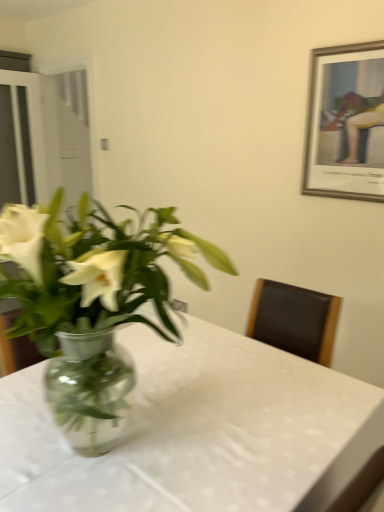
In order to face transparent glass door at left, which is the second glass door in left-to-right order, should I rotate leftwards or rightwards?

You should rotate left by 15.730 degrees.

Where is `transparent glass door at left, which is the first glass door from right to left`? This screenshot has height=512, width=384. transparent glass door at left, which is the first glass door from right to left is located at coordinates (67, 134).

Where is `clear glass vase at center`? This screenshot has height=512, width=384. clear glass vase at center is located at coordinates (92, 302).

You are a GUI agent. You are given a task and a screenshot of the screen. Output one action in this format:
    pyautogui.click(x=<x>, y=<y>)
    Task: Click on the houseplant below the silver/golden frame at upper right (from the image's perspective)
    This screenshot has width=384, height=512.
    Given the screenshot: What is the action you would take?
    pyautogui.click(x=92, y=302)

Consider the image. Considering the sizes of objects clear glass vase at center and silver/golden frame at upper right in the image provided, who is taller, clear glass vase at center or silver/golden frame at upper right?

silver/golden frame at upper right.

Considering the sizes of objects clear glass vase at center and silver/golden frame at upper right in the image provided, who is bigger, clear glass vase at center or silver/golden frame at upper right?

With larger size is clear glass vase at center.

Which object is thinner, clear glass vase at center or silver/golden frame at upper right?

With smaller width is silver/golden frame at upper right.

From the picture: Is transparent glass table at center completely or partially inside transparent glass door at left, the second glass door viewed from the right?

No.

Considering the relative sizes of transparent glass door at left, the second glass door viewed from the right, and transparent glass table at center in the image provided, is transparent glass door at left, the second glass door viewed from the right, thinner than transparent glass table at center?

Correct, the width of transparent glass door at left, the second glass door viewed from the right, is less than that of transparent glass table at center.

Is transparent glass door at left, arranged as the first glass door when viewed from the left, facing away from transparent glass table at center?

No, transparent glass door at left, arranged as the first glass door when viewed from the left,'s orientation is not away from transparent glass table at center.

Consider the image. Between transparent glass table at center and transparent glass door at left, which is the second glass door in left-to-right order, which one appears on the left side from the viewer's perspective?

Positioned to the left is transparent glass door at left, which is the second glass door in left-to-right order.

From the image's perspective, is transparent glass table at center on top of transparent glass door at left, which is the first glass door from right to left?

No, from the image's perspective, transparent glass table at center is not on top of transparent glass door at left, which is the first glass door from right to left.

Which is correct: transparent glass table at center is inside transparent glass door at left, which is the second glass door in left-to-right order, or outside of it?

transparent glass table at center cannot be found inside transparent glass door at left, which is the second glass door in left-to-right order.

From a real-world perspective, is transparent glass table at center positioned above or below transparent glass door at left, which is the second glass door in left-to-right order?

Clearly, from a real-world perspective, transparent glass table at center is below transparent glass door at left, which is the second glass door in left-to-right order.

Does clear glass vase at center have a greater width compared to transparent glass table at center?

Incorrect, the width of clear glass vase at center does not surpass that of transparent glass table at center.

From a real-world perspective, is clear glass vase at center located higher than transparent glass table at center?

Indeed, from a real-world perspective, clear glass vase at center stands above transparent glass table at center.

Between clear glass vase at center and transparent glass table at center, which one has larger size?

transparent glass table at center.

Which is less distant, (28, 144) or (315, 49)?

Point (28, 144).

What's the angular difference between transparent glass door at left, arranged as the first glass door when viewed from the left, and silver/golden frame at upper right's facing directions?

There is a 87.4-degree angle between the facing directions of transparent glass door at left, arranged as the first glass door when viewed from the left, and silver/golden frame at upper right.

Between transparent glass door at left, arranged as the first glass door when viewed from the left, and silver/golden frame at upper right, which one appears on the right side from the viewer's perspective?

From the viewer's perspective, silver/golden frame at upper right appears more on the right side.

From a real-world perspective, is silver/golden frame at upper right under transparent glass table at center?

No, from a real-world perspective, silver/golden frame at upper right is not below transparent glass table at center.

Are silver/golden frame at upper right and transparent glass table at center beside each other?

They are not placed beside each other.

From the image's perspective, would you say silver/golden frame at upper right is shown under transparent glass table at center?

Incorrect, from the image's perspective, silver/golden frame at upper right is higher than transparent glass table at center.

In the image, is silver/golden frame at upper right on the left side or the right side of transparent glass table at center?

In the image, silver/golden frame at upper right appears on the right side of transparent glass table at center.

Which is more to the right, transparent glass door at left, which is the first glass door from right to left, or transparent glass door at left, arranged as the first glass door when viewed from the left?

transparent glass door at left, which is the first glass door from right to left, is more to the right.

Based on the photo, does transparent glass door at left, which is the first glass door from right to left, turn towards transparent glass door at left, the second glass door viewed from the right?

Yes, transparent glass door at left, which is the first glass door from right to left, is oriented towards transparent glass door at left, the second glass door viewed from the right.

Identify the location of glass door above the transparent glass door at left, the second glass door viewed from the right (from the image's perspective). (67, 134).

Find the location of a particular element. The image size is (384, 512). picture frame above the clear glass vase at center (from a real-world perspective) is located at coordinates (346, 123).

Locate an element on the screen. The image size is (384, 512). table beneath the transparent glass door at left, arranged as the first glass door when viewed from the left (from a real-world perspective) is located at coordinates (198, 433).

Estimate the real-world distances between objects in this image. Which object is further from transparent glass door at left, the second glass door viewed from the right, clear glass vase at center or transparent glass table at center?

clear glass vase at center is positioned further to the anchor transparent glass door at left, the second glass door viewed from the right.

From the image, which object appears to be farther from clear glass vase at center, silver/golden frame at upper right or transparent glass door at left, the second glass door viewed from the right?

Based on the image, transparent glass door at left, the second glass door viewed from the right, appears to be further to clear glass vase at center.

Which object lies nearer to the anchor point clear glass vase at center, transparent glass table at center or transparent glass door at left, arranged as the first glass door when viewed from the left?

transparent glass table at center lies closer to clear glass vase at center than the other object.

Based on their spatial positions, is transparent glass door at left, the second glass door viewed from the right, or silver/golden frame at upper right closer to transparent glass table at center?

silver/golden frame at upper right is positioned closer to the anchor transparent glass table at center.

Considering their positions, is transparent glass table at center positioned further to clear glass vase at center than transparent glass door at left, which is the second glass door in left-to-right order?

transparent glass door at left, which is the second glass door in left-to-right order, is positioned further to the anchor clear glass vase at center.

When comparing their distances from transparent glass table at center, does transparent glass door at left, arranged as the first glass door when viewed from the left, or transparent glass door at left, which is the second glass door in left-to-right order, seem closer?

Among the two, transparent glass door at left, which is the second glass door in left-to-right order, is located nearer to transparent glass table at center.

When comparing their distances from transparent glass table at center, does silver/golden frame at upper right or transparent glass door at left, arranged as the first glass door when viewed from the left, seem further?

transparent glass door at left, arranged as the first glass door when viewed from the left, is positioned further to the anchor transparent glass table at center.

From the image, which object appears to be nearer to silver/golden frame at upper right, transparent glass door at left, the second glass door viewed from the right, or clear glass vase at center?

clear glass vase at center is positioned closer to the anchor silver/golden frame at upper right.

Locate an element on the screen. The height and width of the screenshot is (512, 384). table between clear glass vase at center and transparent glass door at left, which is the first glass door from right to left, in the front-back direction is located at coordinates (198, 433).

Find the location of a particular element. table located between clear glass vase at center and silver/golden frame at upper right in the depth direction is located at coordinates (198, 433).

Identify the location of picture frame positioned between transparent glass table at center and transparent glass door at left, the second glass door viewed from the right, from near to far. This screenshot has width=384, height=512. point(346,123).

I want to click on glass door between transparent glass table at center and transparent glass door at left, the second glass door viewed from the right, from front to back, so click(67, 134).